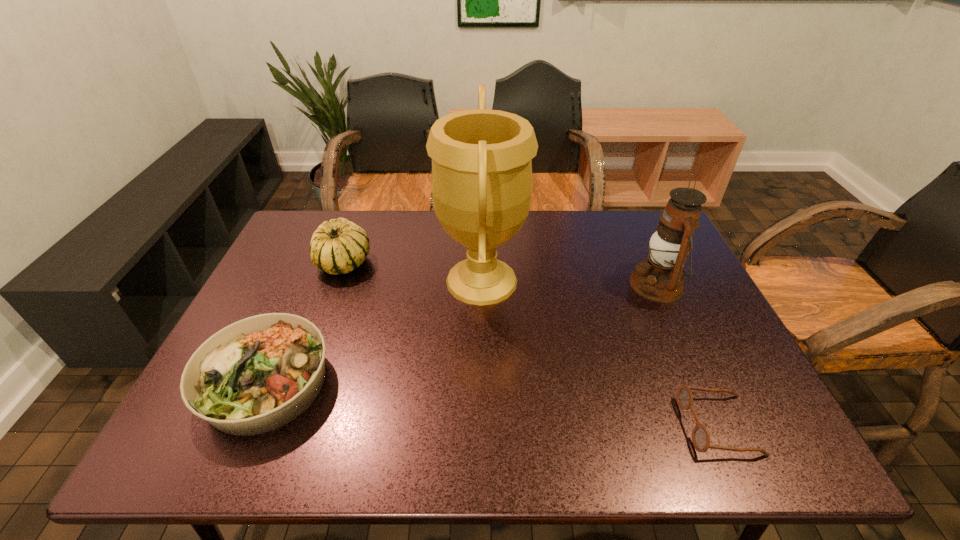
At what (x,y) coordinates should I click in order to perform the action: click on vacant region located on the side of the fourth shortest object, there is a wick adjustment knob. Please return your answer as a coordinate pair (x, y). This screenshot has height=540, width=960. Looking at the image, I should click on (563, 285).

Find the location of a particular element. Image resolution: width=960 pixels, height=540 pixels. free space located 0.070m on the side of the fourth shortest object, there is a wick adjustment knob is located at coordinates (605, 285).

Where is `blank space located on the front of the gourd`? blank space located on the front of the gourd is located at coordinates (316, 341).

Where is `vacant point located on the right of the fourth tallest object`? vacant point located on the right of the fourth tallest object is located at coordinates (495, 383).

Find the location of a particular element. The height and width of the screenshot is (540, 960). vacant area situated on the front-facing side of the spectacles is located at coordinates (569, 425).

Identify the location of free space located on the front-facing side of the spectacles. (593, 425).

What are the coordinates of `free space located on the front-facing side of the spectacles` in the screenshot? It's located at (641, 425).

You are a GUI agent. You are given a task and a screenshot of the screen. Output one action in this format:
    pyautogui.click(x=<x>, y=<y>)
    Task: Click on the trophy present at the far edge
    
    Given the screenshot: What is the action you would take?
    pyautogui.click(x=481, y=182)

Where is `gourd at the far edge`? gourd at the far edge is located at coordinates (339, 246).

At what (x,y) coordinates should I click in order to perform the action: click on salad plate located in the near edge section of the desktop. Please return your answer as a coordinate pair (x, y). The width and height of the screenshot is (960, 540). Looking at the image, I should click on (260, 373).